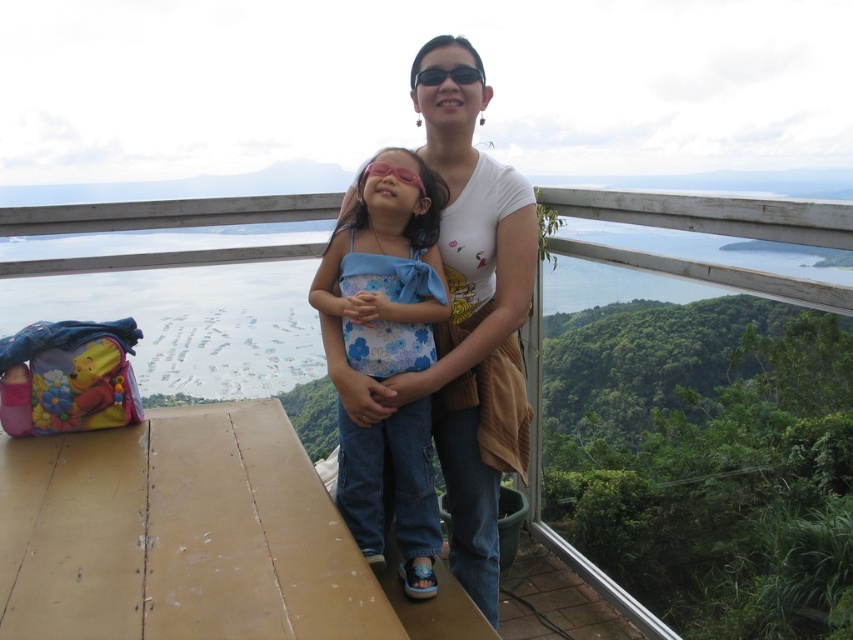
You are a photographer trying to capture a group photo of the white cotton shirt at center and the floral fabric swimsuit at center. The camera you are using has a maximum width capacity of 1.5 meters. Can both subjects fit within the frame without cropping?

The white cotton shirt at center is wider than the floral fabric swimsuit at center. Since the camera has a maximum width capacity of 1.5 meters, the total width of both subjects combined must be less than or equal to 1.5 meters. However, without knowing the exact widths of each subject, it is impossible to determine if they will fit within the frame.

You are a photographer trying to capture a group photo of the white cotton shirt at center and the floral fabric swimsuit at center. Which subject should you position to the left to ensure they are both in the frame?

The floral fabric swimsuit at center should be positioned to the left because the white cotton shirt at center is currently on the right side of it.

Looking at this image, you are a photographer who wants to capture a photo of the white cotton shirt at center and the floral fabric swimsuit at center in the image. Which clothing item appears taller in the picture?

The white cotton shirt at center appears taller than the floral fabric swimsuit at center in the image.